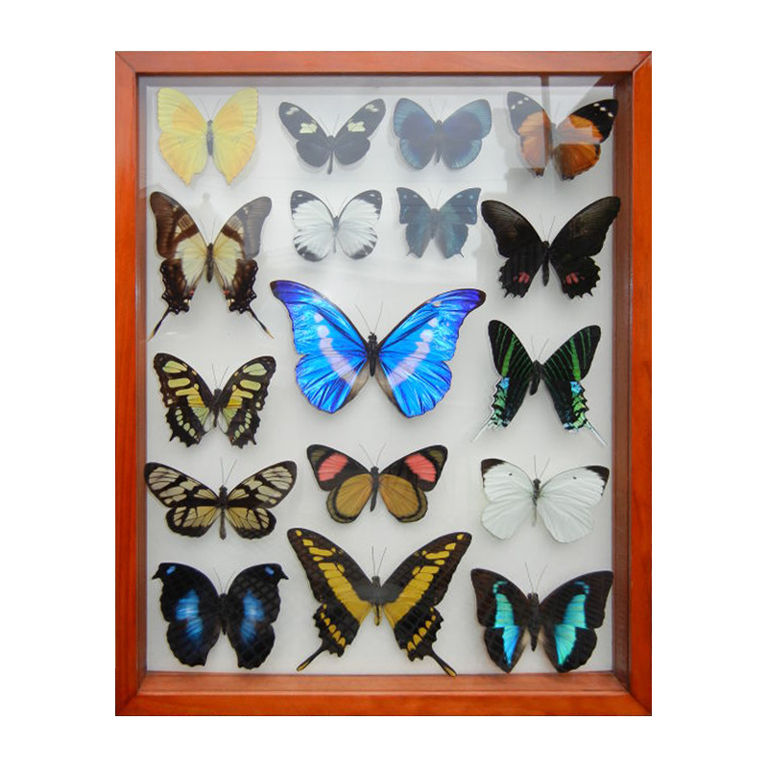
This screenshot has height=768, width=768. In order to click on wood sides of display case in this screenshot , I will do (283, 65), (126, 396), (643, 406), (372, 677).